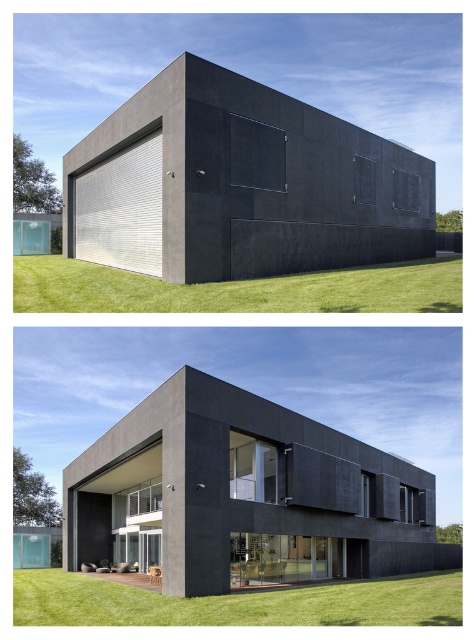
You are an architect designing a new modern house and want to place a rectangular window in the matte black wall at center. According to the design plan, the window should be placed at coordinates point 0.289, 0.505. Is this the correct location for the window?

Yes, the matte black wall at center is located at point [239,184], so placing the window there would be correct.

You are an architect analyzing the modern house. You notice two matte black elements in the image. Which one is positioned higher up, the matte black wall at center or the matte black house at center?

The matte black wall at center is located above the matte black house at center, so it is positioned higher up.